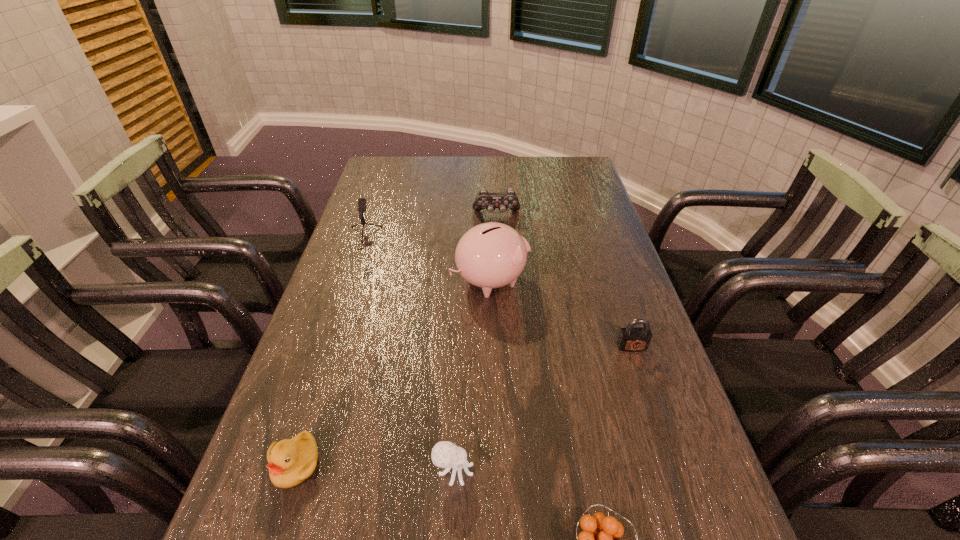
Find the location of `empty space between the octopus and the duckling`. empty space between the octopus and the duckling is located at coordinates (374, 467).

Find the location of a particular element. empty space that is in between the rightmost object and the octopus is located at coordinates (542, 409).

At what (x,y) coordinates should I click in order to perform the action: click on empty space between the control and the padlock. Please return your answer as a coordinate pair (x, y). This screenshot has height=540, width=960. Looking at the image, I should click on (564, 281).

Image resolution: width=960 pixels, height=540 pixels. What are the coordinates of `vacant area that lies between the microphone and the octopus` in the screenshot? It's located at (407, 356).

Where is `unoccupied area between the microphone and the farthest object`? unoccupied area between the microphone and the farthest object is located at coordinates (429, 228).

Where is `blank region between the octopus and the farthest object`? This screenshot has height=540, width=960. blank region between the octopus and the farthest object is located at coordinates (475, 343).

The width and height of the screenshot is (960, 540). Find the location of `unoccupied area between the farthest object and the padlock`. unoccupied area between the farthest object and the padlock is located at coordinates (564, 281).

The width and height of the screenshot is (960, 540). Identify the location of free point between the octopus and the microphone. (407, 356).

Identify the location of vacant space in between the padlock and the duckling. The width and height of the screenshot is (960, 540). (464, 406).

Where is `object that is the third closest to the octopus`? The width and height of the screenshot is (960, 540). object that is the third closest to the octopus is located at coordinates (490, 255).